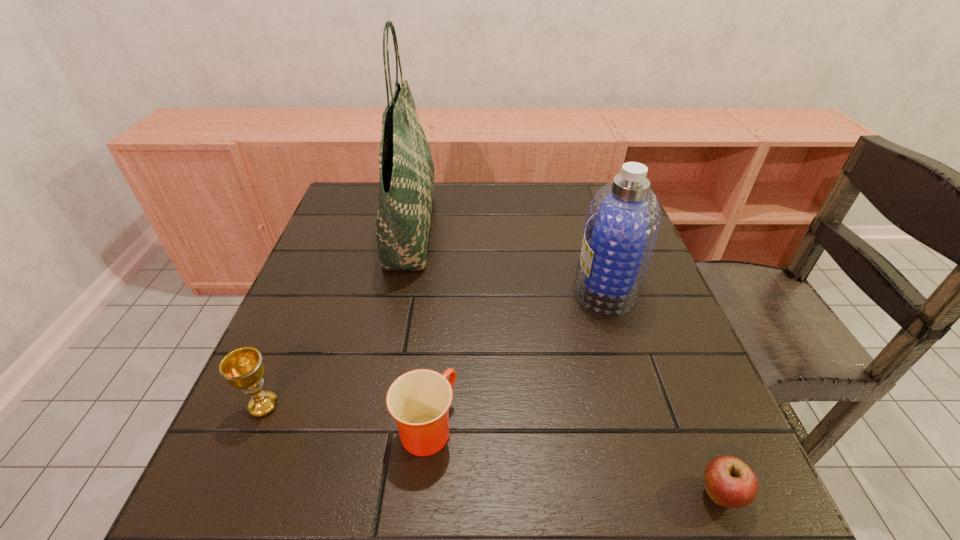
This screenshot has width=960, height=540. Identify the location of free area in between the nearest object and the cup. (573, 461).

Identify the location of empty location between the cup and the tote bag. (419, 327).

Locate an element on the screen. The width and height of the screenshot is (960, 540). vacant region between the cup and the apple is located at coordinates (573, 461).

What are the coordinates of `object that is the third closest one to the chalice` in the screenshot? It's located at (622, 223).

Select which object appears as the closest to the leftmost object. Please provide its 2D coordinates. Your answer should be formatted as a tuple, i.e. [(x, y)], where the tuple contains the x and y coordinates of a point satisfying the conditions above.

[(419, 400)]

This screenshot has width=960, height=540. What are the coordinates of `vacant area that satisfies the following two spatial constraints: 1. on the back side of the cleansing agent; 2. on the right side of the chalice` in the screenshot? It's located at click(314, 288).

At what (x,y) coordinates should I click in order to perform the action: click on vacant region that satisfies the following two spatial constraints: 1. on the front side of the tallest object; 2. on the right side of the apple. Please return your answer as a coordinate pair (x, y). The image size is (960, 540). Looking at the image, I should click on (355, 494).